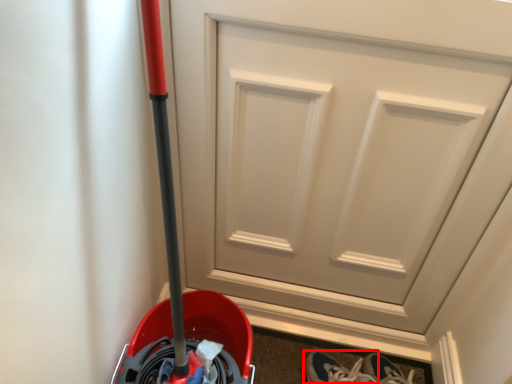
Question: Observing the image, what is the correct spatial positioning of footwear (annotated by the red box) in reference to door?

Choices:
 (A) right
 (B) left

Answer: (A)